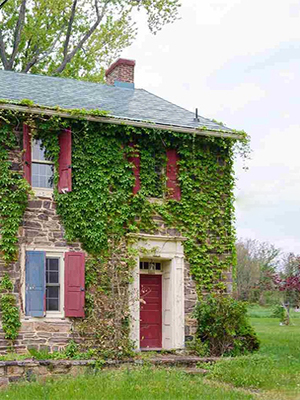
Locate an element on the screen. Image resolution: width=300 pixels, height=400 pixels. 2nd story windows is located at coordinates (42, 161), (161, 177).